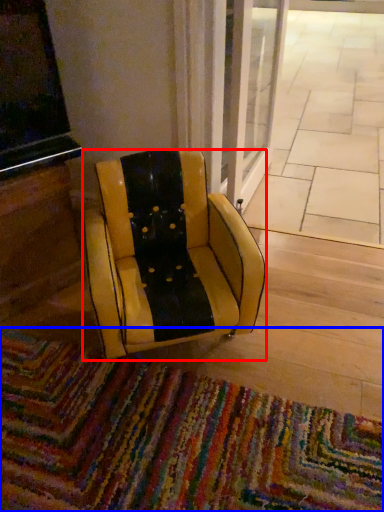
Question: Which of the following is the farthest to the observer, chair (highlighted by a red box) or mat (highlighted by a blue box)?

Choices:
 (A) chair
 (B) mat

Answer: (A)